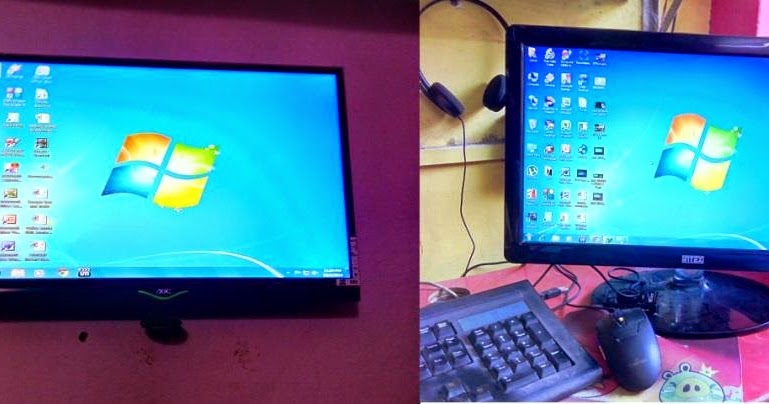
The image size is (769, 404). Identify the location of mouse pad. (711, 361), (584, 325), (593, 390).